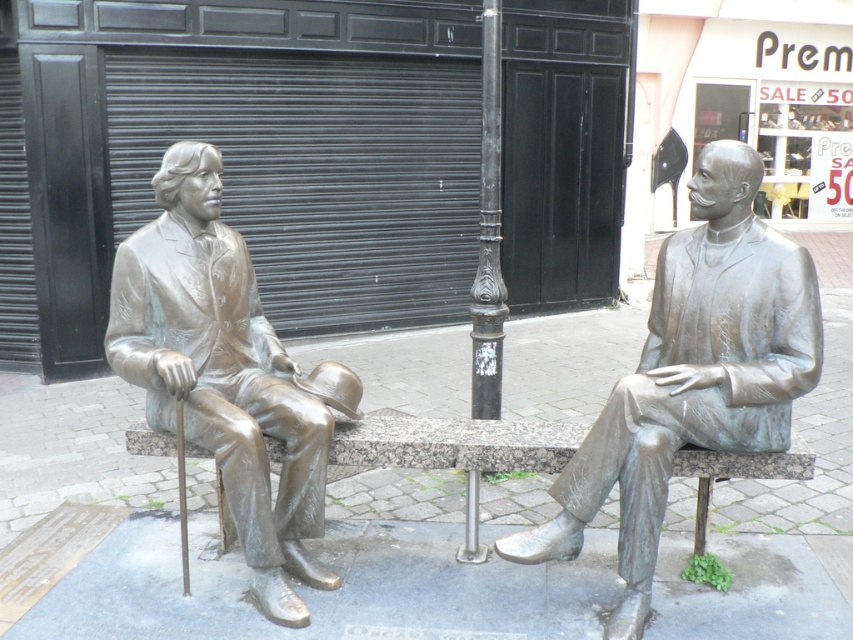
You are a city planner assessing the space between the two bronze statues. You need to place a small flowerpot that requires at least 1 meter of space. Can the flowerpot fit between the bronze statue at right and the bronze statue at left?

The bronze statue at right might be wider than bronze statue at left, so the space between them may not be sufficient for a flowerpot requiring 1 meter of space. Further measurement is needed.

Based on the photo, you are an artist planning to create a miniature replica of this scene. You have a limited amount of bronze material. Given that the bronze statue at left and the bronze stone bench at center are both made of bronze, which object would require more bronze material and why?

The bronze stone bench at center requires more bronze material because it is thicker than the bronze statue at left.